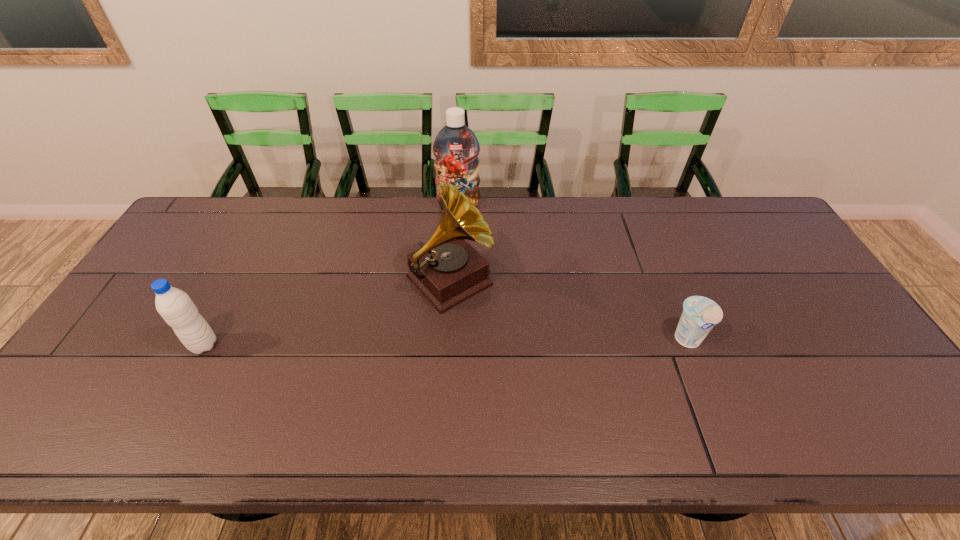
The height and width of the screenshot is (540, 960). Identify the location of the leftmost object. (175, 306).

At what (x,y) coordinates should I click in order to perform the action: click on the second shortest object. Please return your answer as a coordinate pair (x, y). Looking at the image, I should click on (175, 306).

Identify the location of yogurt. The image size is (960, 540). (700, 314).

The image size is (960, 540). I want to click on the shortest object, so click(x=700, y=314).

Find the location of `the third nearest object`. the third nearest object is located at coordinates (447, 270).

Identify the location of shampoo. The image size is (960, 540). (456, 148).

Identify the location of free location located on the front of the third tallest object. (189, 373).

Image resolution: width=960 pixels, height=540 pixels. Find the location of `vacant space located on the back of the rightmost object`. vacant space located on the back of the rightmost object is located at coordinates (667, 287).

Locate an element on the screen. The width and height of the screenshot is (960, 540). blank space located 0.200m from the horn of the phonograph record is located at coordinates (522, 355).

Locate an element on the screen. This screenshot has height=540, width=960. vacant space situated from the horn of the phonograph record is located at coordinates (530, 363).